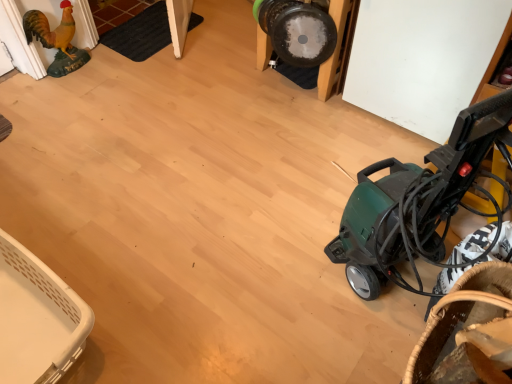
Find the location of `vacant region to the right of white plastic basket at lower left, the second basket in the front-to-back sequence`. vacant region to the right of white plastic basket at lower left, the second basket in the front-to-back sequence is located at coordinates (164, 299).